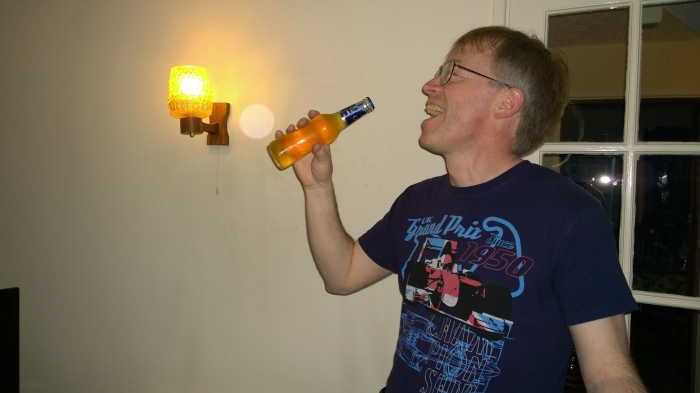
Identify the location of lightbulb. The image size is (700, 393). (192, 85).